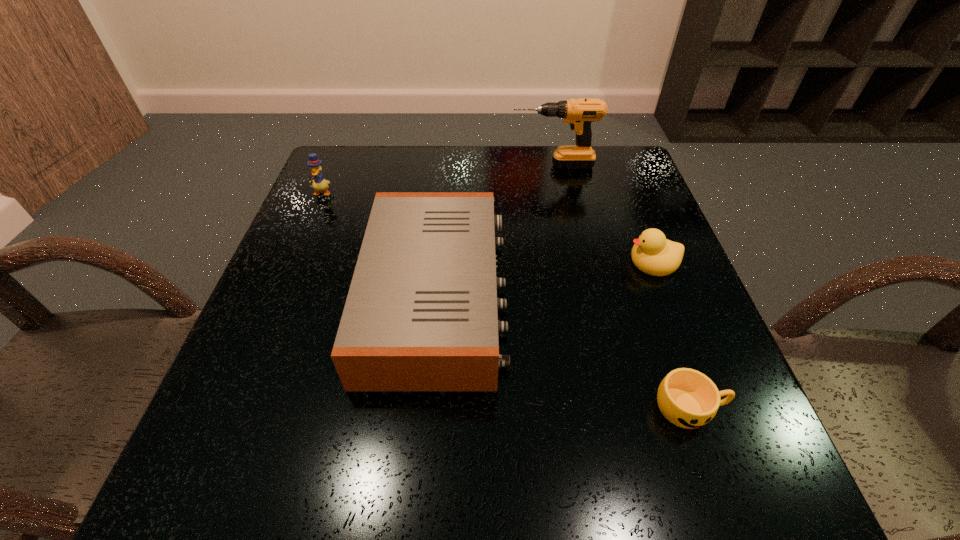
The height and width of the screenshot is (540, 960). I want to click on free location that satisfies the following two spatial constraints: 1. on the front panel of the shortest object; 2. on the right side of the radio receiver, so click(x=426, y=407).